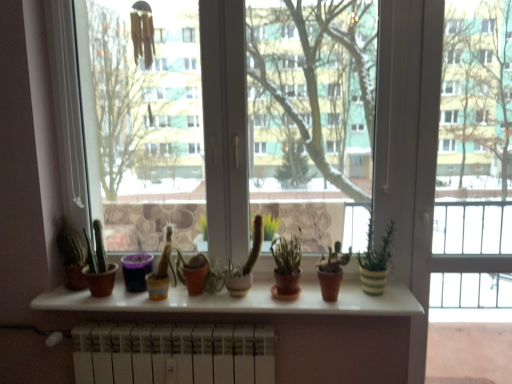
Question: From the image's perspective, is terracotta clay pot at center, which is the 5th houseplant from left to right, above or below matte brown cactus at left, acting as the 1th houseplant starting from the left?

Choices:
 (A) above
 (B) below

Answer: (B)

Question: Considering the relative positions of terracotta clay pot at center, which is the 5th houseplant from left to right, and matte brown cactus at left, acting as the 1th houseplant starting from the left, in the image provided, is terracotta clay pot at center, which is the 5th houseplant from left to right, to the left or to the right of matte brown cactus at left, acting as the 1th houseplant starting from the left,?

Choices:
 (A) left
 (B) right

Answer: (B)

Question: Which is nearer to the green striped pot at right, positioned as the first houseplant in right-to-left order?

Choices:
 (A) white matte radiator at lower center
 (B) matte terracotta pot at center, the 1th flowerpot from the right
 (C) matte brown cactus at left, the second houseplant positioned from the left
 (D) green matte cactus at center, which appears as the 4th houseplant when viewed from the right
 (E) terracotta clay pot at center, which is the 5th houseplant from left to right

Answer: (E)

Question: Which object is the closest to the green matte cactus at center, which is counted as the 3th houseplant, starting from the left?

Choices:
 (A) white matte radiator at lower center
 (B) purple matte flowerpot at center, which ranks as the first flowerpot in left-to-right order
 (C) green matte cactus at center, the fourth houseplant in the left-to-right sequence
 (D) white glossy window sill at center
 (E) green striped pot at right, positioned as the first houseplant in right-to-left order

Answer: (C)